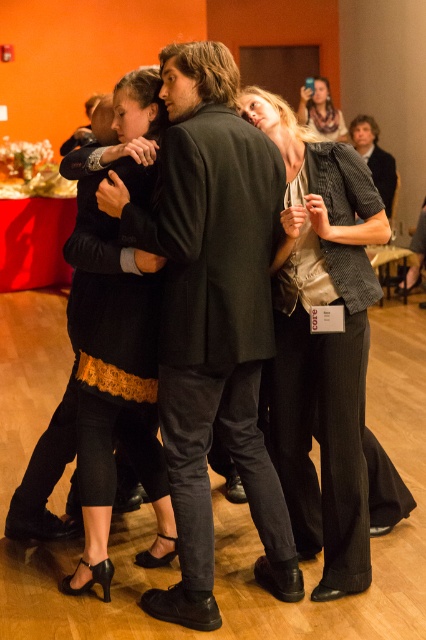
You are attending a formal event and notice two items of clothing in the scene. The first is the black matte suit at center, and the second is the matte beige scarf at upper center. Which item appears bigger in size?

The black matte suit at center is larger in size than the matte beige scarf at upper center.